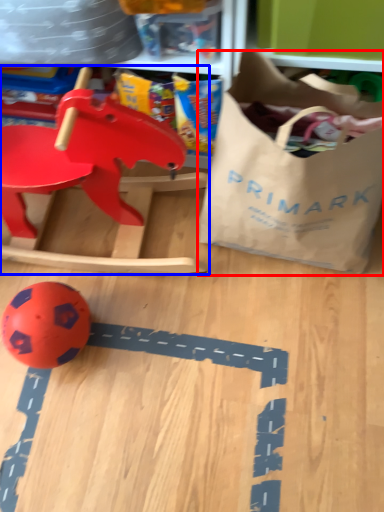
Question: Which point is further to the camera, grocery bag (highlighted by a red box) or toy (highlighted by a blue box)?

Choices:
 (A) grocery bag
 (B) toy

Answer: (B)